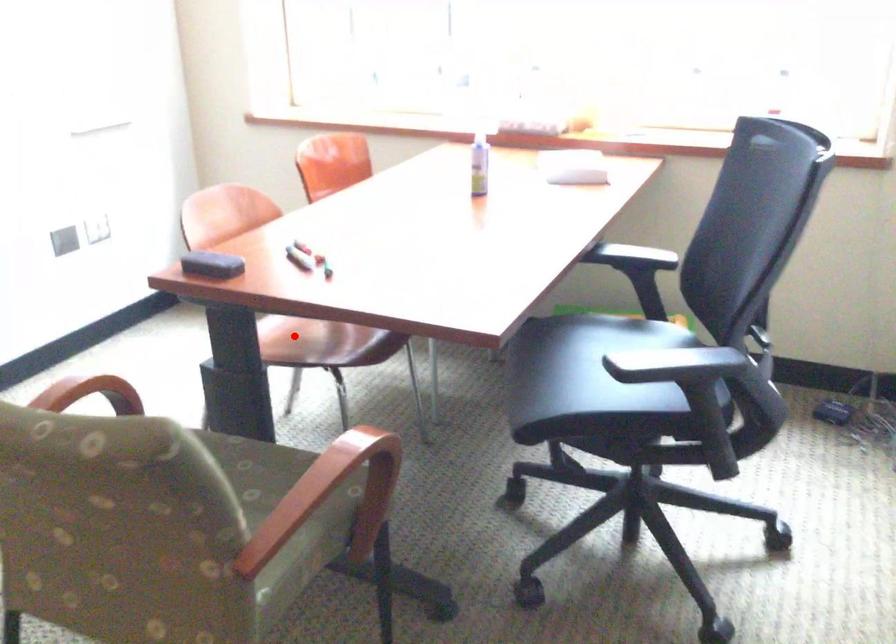
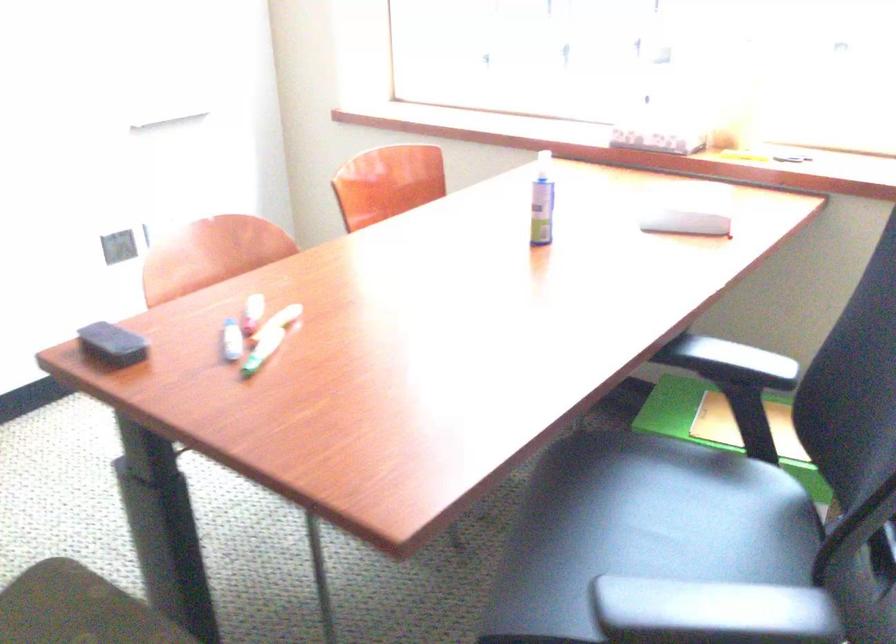
Question: I am providing you with two images of the same scene from different viewpoints. A red point is marked on the first image. At the location where the point appears in image 1, is it still visible in image 2?

Choices:
 (A) Yes
 (B) No

Answer: (B)